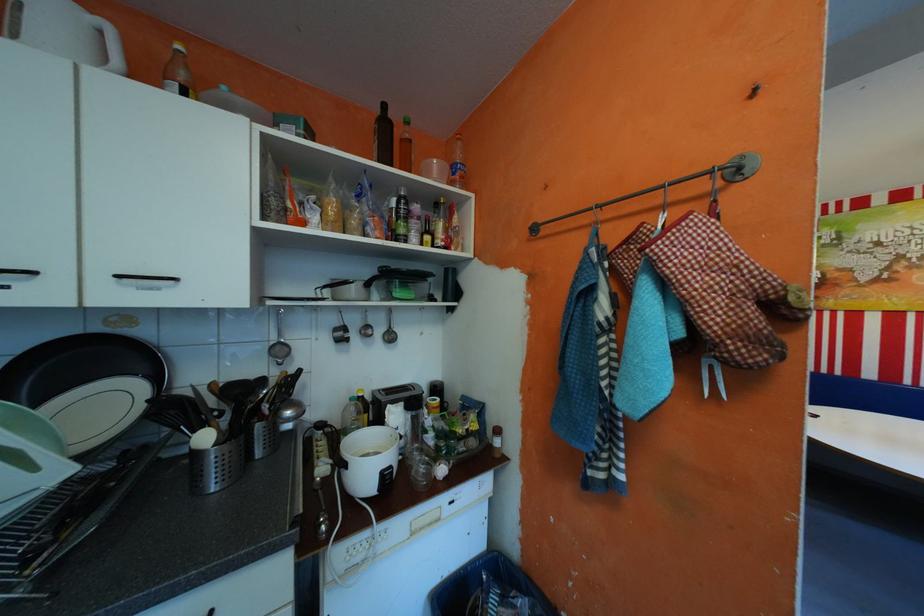
The height and width of the screenshot is (616, 924). What are the coordinates of `clear oil bottle` in the screenshot? It's located at (351, 416).